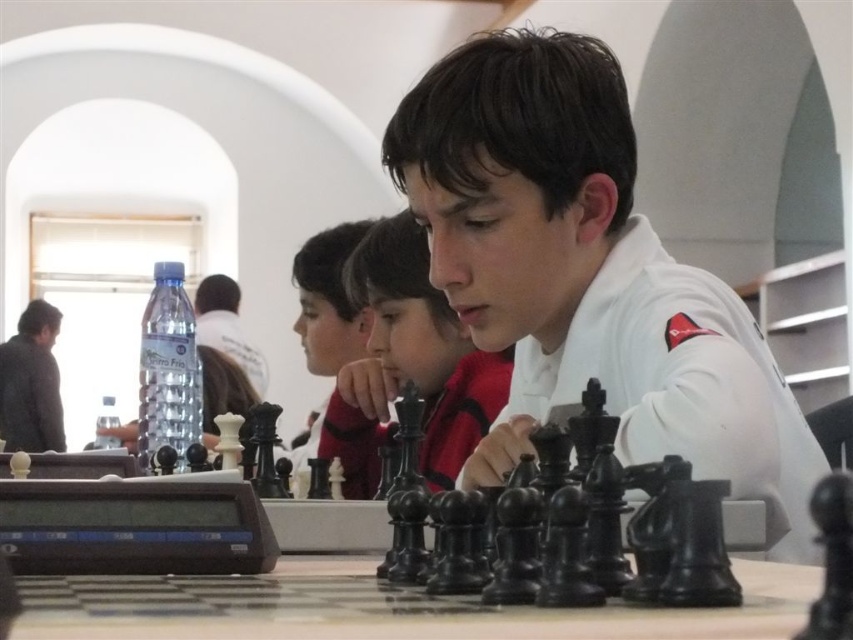
What are the coordinates of the matte black chess set at center?

The matte black chess set at center is located at point (589, 275).

You are a chess player who needs to move your piece from the dark gray sweater at left to the matte black chess piece at center. Can you do it in one move without crossing the chessboard?

The distance between the matte black chess piece at center and the dark gray sweater at left is 3.16 meters, so you can move your piece from the dark gray sweater at left to the matte black chess piece at center in one move without crossing the chessboard.